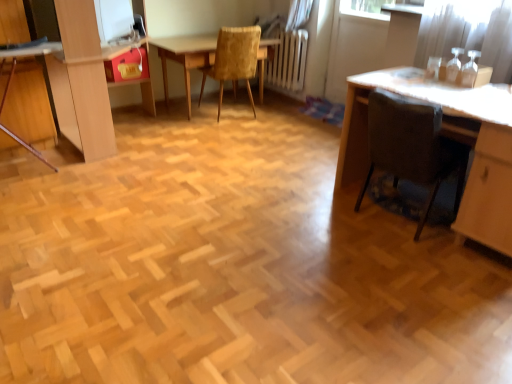
Where is `free region under matte wooden dresser at left (from a real-world perspective)`? free region under matte wooden dresser at left (from a real-world perspective) is located at coordinates (134, 128).